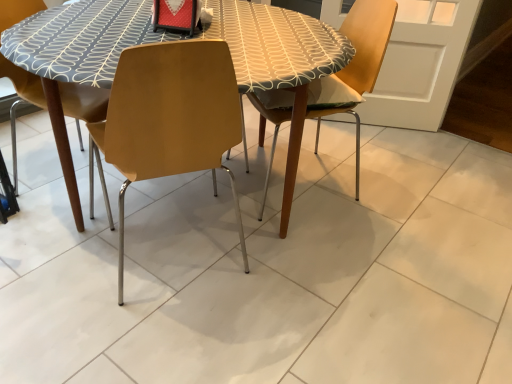
Locate an element on the screen. The height and width of the screenshot is (384, 512). vacant area that is situated to the right of matte wood chair at center, acting as the 1th chair starting from the left is located at coordinates (274, 285).